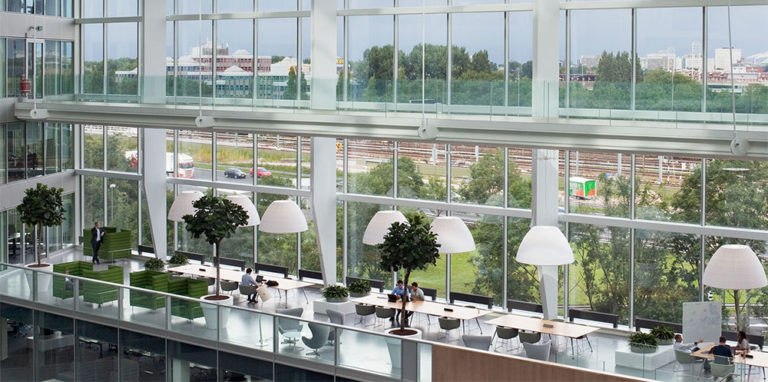
You are a GUI agent. You are given a task and a screenshot of the screen. Output one action in this format:
    pyautogui.click(x=<x>, y=<y>)
    Task: Click on the green furniture
    
    Given the screenshot: What is the action you would take?
    pyautogui.click(x=113, y=245), pyautogui.click(x=187, y=288), pyautogui.click(x=144, y=279), pyautogui.click(x=98, y=277), pyautogui.click(x=70, y=266)